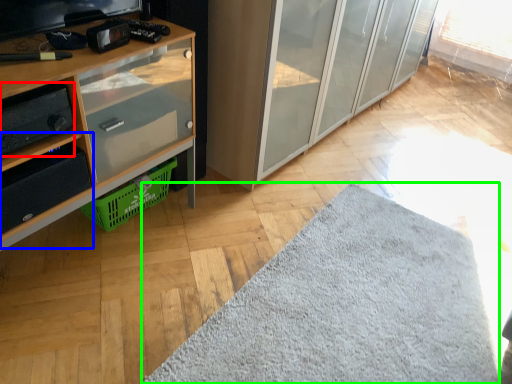
Question: Estimate the real-world distances between objects in this image. Which object is farther from stereo (highlighted by a red box), shelf (highlighted by a blue box) or mat (highlighted by a green box)?

Choices:
 (A) shelf
 (B) mat

Answer: (B)